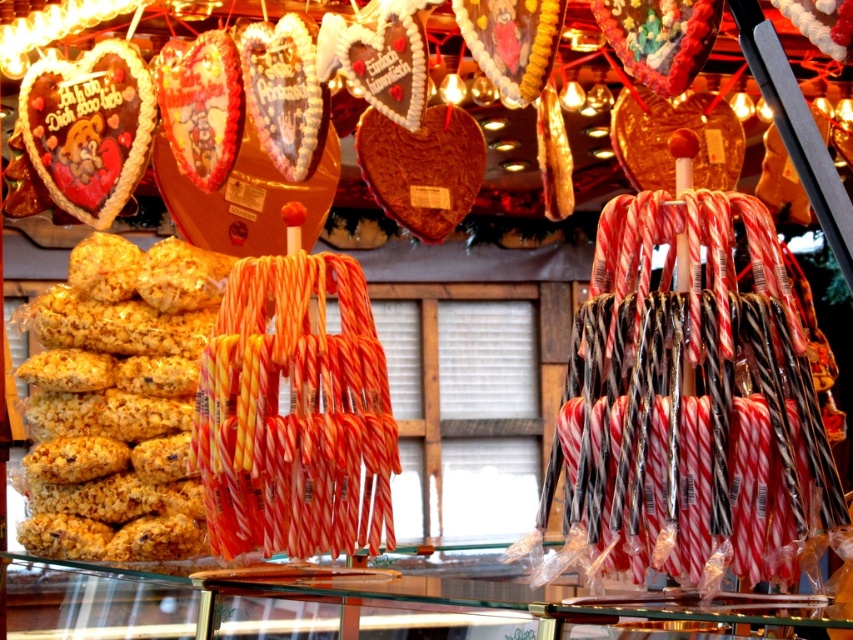
Question: Is crispy yellow popcorn at left positioned before matte chocolate heart at upper left?

Choices:
 (A) yes
 (B) no

Answer: (B)

Question: Can you confirm if crispy yellow popcorn at left is bigger than matte chocolate heart at upper left?

Choices:
 (A) no
 (B) yes

Answer: (B)

Question: Among these objects, which one is farthest from the camera?

Choices:
 (A) matte chocolate heart at upper left
 (B) crispy yellow popcorn at left

Answer: (B)

Question: Does crispy yellow popcorn at left have a smaller size compared to matte chocolate heart at upper left?

Choices:
 (A) no
 (B) yes

Answer: (A)

Question: Among these objects, which one is farthest from the camera?

Choices:
 (A) crispy yellow popcorn at left
 (B) matte chocolate heart at upper left

Answer: (A)